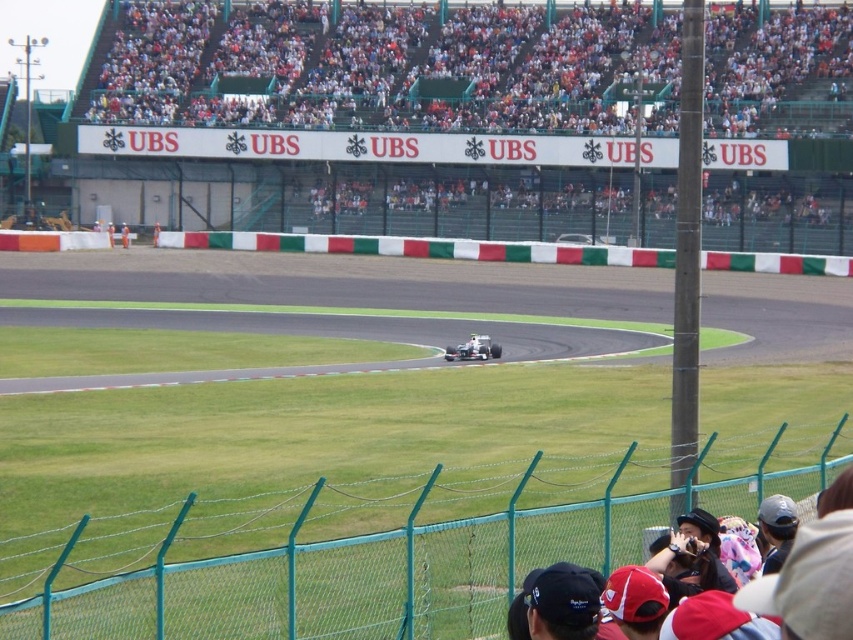
Question: Which object is positioned farthest from the white cotton cap at lower right?

Choices:
 (A) white fabric person at center
 (B) matte black hat at lower right
 (C) white plastic helmet at center

Answer: (A)

Question: Which object appears farthest from the camera in this image?

Choices:
 (A) orange fabric person at center
 (B) white plastic helmet at center
 (C) matte black hat at lower right
 (D) white matte race car at center

Answer: (A)

Question: Is the position of white cotton cap at lower right more distant than that of white plastic helmet at center?

Choices:
 (A) no
 (B) yes

Answer: (A)

Question: Which object appears farthest from the camera in this image?

Choices:
 (A) black fabric cap at lower center
 (B) matte black hat at lower right
 (C) white fabric person at center

Answer: (C)

Question: Does white plastic seats at upper center appear over orange fabric person at center?

Choices:
 (A) no
 (B) yes

Answer: (B)

Question: Is white matte race car at center above white fabric person at center?

Choices:
 (A) yes
 (B) no

Answer: (B)